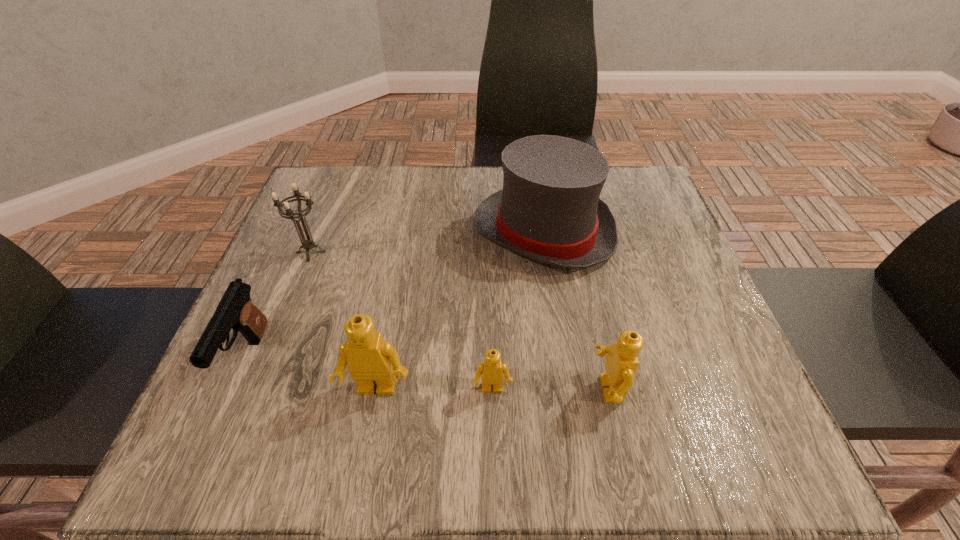
At what (x,y) coordinates should I click in order to perform the action: click on the leftmost Lego. Please return your answer as a coordinate pair (x, y). Looking at the image, I should click on [371, 361].

The image size is (960, 540). Find the location of `the second Lego from right to left`. the second Lego from right to left is located at coordinates (492, 370).

The width and height of the screenshot is (960, 540). I want to click on the shortest Lego, so 492,370.

Find the location of a particular element. This screenshot has height=540, width=960. the second shortest Lego is located at coordinates (621, 364).

Image resolution: width=960 pixels, height=540 pixels. I want to click on dress hat, so click(x=549, y=210).

This screenshot has height=540, width=960. I want to click on candle holder, so coord(308,244).

Locate an element on the screen. The width and height of the screenshot is (960, 540). pistol is located at coordinates [235, 310].

This screenshot has width=960, height=540. I want to click on free space located on the face of the second shortest Lego, so click(359, 389).

The width and height of the screenshot is (960, 540). In order to click on vacant space located on the face of the second shortest Lego in this screenshot , I will do `click(377, 389)`.

Find the location of a particular element. vacant space located on the face of the second shortest Lego is located at coordinates (479, 389).